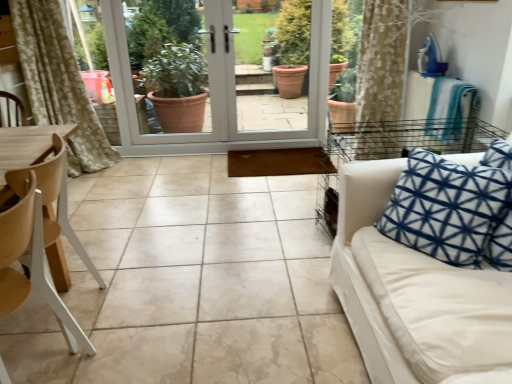
Measure the distance between point [362,296] and camera.

Point [362,296] is 1.62 meters away from camera.

Describe the element at coordinates (414, 295) in the screenshot. The height and width of the screenshot is (384, 512). I see `white fabric couch at right` at that location.

Identify the location of white glossy screen door at center. (223, 89).

Considering the relative sizes of white glossy screen door at center and wooden at left, the 2th chair in the front-to-back sequence, in the image provided, is white glossy screen door at center smaller than wooden at left, the 2th chair in the front-to-back sequence,?

Incorrect, white glossy screen door at center is not smaller in size than wooden at left, the 2th chair in the front-to-back sequence.

From a real-world perspective, is white glossy screen door at center above or below wooden at left, the 2th chair in the front-to-back sequence?

From a real-world perspective, white glossy screen door at center is physically above wooden at left, the 2th chair in the front-to-back sequence.

Which object is thinner, white glossy screen door at center or wooden at left, the 2th chair in the front-to-back sequence?

white glossy screen door at center.

Locate an element on the screen. the 1st chair positioned below the white glossy screen door at center (from the image's perspective) is located at coordinates (54, 200).

Based on the photo, do you think white wood chair at left, the 1th chair positioned from the front, is within white fabric couch at right, or outside of it?

white wood chair at left, the 1th chair positioned from the front, is not inside white fabric couch at right, it's outside.

Considering the positions of objects white wood chair at left, the 1th chair positioned from the front, and white fabric couch at right in the image provided, who is in front, white wood chair at left, the 1th chair positioned from the front, or white fabric couch at right?

white fabric couch at right is closer to the camera.

From the image's perspective, which is above, white wood chair at left, the 2th chair from the back, or white fabric couch at right?

white fabric couch at right appears higher in the image.

Would you consider white wood chair at left, the 2th chair from the back, to be distant from white fabric couch at right?

Absolutely, white wood chair at left, the 2th chair from the back, is distant from white fabric couch at right.

In the scene shown: Considering the positions of objects white fabric couch at right and wooden at left, placed as the 1th chair when sorted from back to front, in the image provided, who is behind, white fabric couch at right or wooden at left, placed as the 1th chair when sorted from back to front,?

wooden at left, placed as the 1th chair when sorted from back to front, is more distant.

Measure the distance from white fabric couch at right to wooden at left, the 2th chair in the front-to-back sequence.

white fabric couch at right and wooden at left, the 2th chair in the front-to-back sequence, are 4.30 feet apart from each other.

Is point (438, 364) positioned after point (62, 227)?

No, it is not.

Considering the sizes of objects white fabric couch at right and wooden at left, placed as the 1th chair when sorted from back to front, in the image provided, who is shorter, white fabric couch at right or wooden at left, placed as the 1th chair when sorted from back to front,?

Standing shorter between the two is wooden at left, placed as the 1th chair when sorted from back to front.

Consider the image. Between white wood chair at left, the 1th chair positioned from the front, and wooden at left, placed as the 1th chair when sorted from back to front, which one has larger width?

Wider between the two is wooden at left, placed as the 1th chair when sorted from back to front.

From a real-world perspective, is white wood chair at left, the 2th chair from the back, over wooden at left, placed as the 1th chair when sorted from back to front?

No, from a real-world perspective, white wood chair at left, the 2th chair from the back, is not on top of wooden at left, placed as the 1th chair when sorted from back to front.

Is wooden at left, placed as the 1th chair when sorted from back to front, located within white wood chair at left, the 2th chair from the back?

That's incorrect, wooden at left, placed as the 1th chair when sorted from back to front, is not inside white wood chair at left, the 2th chair from the back.

Find the location of a particular element. This screenshot has width=512, height=384. chair above the white wood chair at left, the 1th chair positioned from the front (from the image's perspective) is located at coordinates (54, 200).

Consider the image. Between white fabric couch at right and white wood chair at left, the 1th chair positioned from the front, which one has larger size?

white fabric couch at right is bigger.

Is white fabric couch at right not within white wood chair at left, the 1th chair positioned from the front?

Yes, white fabric couch at right is outside of white wood chair at left, the 1th chair positioned from the front.

Between white fabric couch at right and white wood chair at left, the 2th chair from the back, which one has more height?

white fabric couch at right is taller.

Which object is closer to the camera taking this photo, white fabric couch at right or white wood chair at left, the 2th chair from the back?

white fabric couch at right is closer to the camera.

From a real-world perspective, does wooden at left, the 2th chair in the front-to-back sequence, stand above white wood chair at left, the 1th chair positioned from the front?

Indeed, from a real-world perspective, wooden at left, the 2th chair in the front-to-back sequence, stands above white wood chair at left, the 1th chair positioned from the front.

How different are the orientations of wooden at left, the 2th chair in the front-to-back sequence, and white wood chair at left, the 1th chair positioned from the front, in degrees?

The angle between the facing direction of wooden at left, the 2th chair in the front-to-back sequence, and the facing direction of white wood chair at left, the 1th chair positioned from the front, is 9.03 degrees.

Which object is wider, wooden at left, placed as the 1th chair when sorted from back to front, or white wood chair at left, the 1th chair positioned from the front?

wooden at left, placed as the 1th chair when sorted from back to front, is wider.

The height and width of the screenshot is (384, 512). Find the location of `chair lying in front of the wooden at left, placed as the 1th chair when sorted from back to front`. chair lying in front of the wooden at left, placed as the 1th chair when sorted from back to front is located at coordinates (32, 265).

From a real-world perspective, is wooden at left, placed as the 1th chair when sorted from back to front, located higher than white fabric couch at right?

No, from a real-world perspective, wooden at left, placed as the 1th chair when sorted from back to front, is not over white fabric couch at right

How far apart are wooden at left, placed as the 1th chair when sorted from back to front, and white fabric couch at right?

The distance of wooden at left, placed as the 1th chair when sorted from back to front, from white fabric couch at right is 4.30 feet.

Which is behind, point (52, 228) or point (409, 311)?

The point (52, 228) is behind.

Can white fabric couch at right be found inside wooden at left, the 2th chair in the front-to-back sequence?

That's incorrect, white fabric couch at right is not inside wooden at left, the 2th chair in the front-to-back sequence.

The width and height of the screenshot is (512, 384). In order to click on screen door above the wooden at left, the 2th chair in the front-to-back sequence (from the image's perspective) in this screenshot , I will do `click(223, 89)`.

In order to click on studio couch in front of the white wood chair at left, the 1th chair positioned from the front in this screenshot , I will do `click(414, 295)`.

Based on their spatial positions, is white glossy screen door at center or white fabric couch at right further from white wood chair at left, the 1th chair positioned from the front?

white glossy screen door at center is positioned further to the anchor white wood chair at left, the 1th chair positioned from the front.

Considering their positions, is wooden at left, the 2th chair in the front-to-back sequence, positioned further to white wood chair at left, the 1th chair positioned from the front, than white glossy screen door at center?

The object further to white wood chair at left, the 1th chair positioned from the front, is white glossy screen door at center.

From the image, which object appears to be nearer to wooden at left, the 2th chair in the front-to-back sequence, white fabric couch at right or white glossy screen door at center?

The object closer to wooden at left, the 2th chair in the front-to-back sequence, is white fabric couch at right.

In the scene shown: From the image, which object appears to be nearer to white glossy screen door at center, wooden at left, placed as the 1th chair when sorted from back to front, or white wood chair at left, the 1th chair positioned from the front?

The object closer to white glossy screen door at center is wooden at left, placed as the 1th chair when sorted from back to front.

In the scene shown: Considering their positions, is white fabric couch at right positioned closer to wooden at left, placed as the 1th chair when sorted from back to front, than white wood chair at left, the 2th chair from the back?

white wood chair at left, the 2th chair from the back.

From the image, which object appears to be farther from white glossy screen door at center, wooden at left, placed as the 1th chair when sorted from back to front, or white fabric couch at right?

Among the two, white fabric couch at right is located further to white glossy screen door at center.

From the image, which object appears to be farther from white fabric couch at right, white wood chair at left, the 2th chair from the back, or wooden at left, the 2th chair in the front-to-back sequence?

wooden at left, the 2th chair in the front-to-back sequence, is further to white fabric couch at right.

When comparing their distances from white glossy screen door at center, does white fabric couch at right or wooden at left, placed as the 1th chair when sorted from back to front, seem further?

Based on the image, white fabric couch at right appears to be further to white glossy screen door at center.

Find the location of a particular element. The width and height of the screenshot is (512, 384). chair between white wood chair at left, the 2th chair from the back, and white glossy screen door at center in the front-back direction is located at coordinates (54, 200).

This screenshot has width=512, height=384. In order to click on chair located between wooden at left, the 2th chair in the front-to-back sequence, and white fabric couch at right in the left-right direction in this screenshot , I will do `click(32, 265)`.